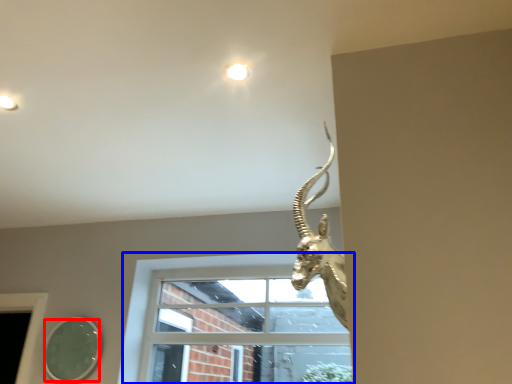
Question: Which point is closer to the camera, mirror (highlighted by a red box) or window (highlighted by a blue box)?

Choices:
 (A) mirror
 (B) window

Answer: (B)